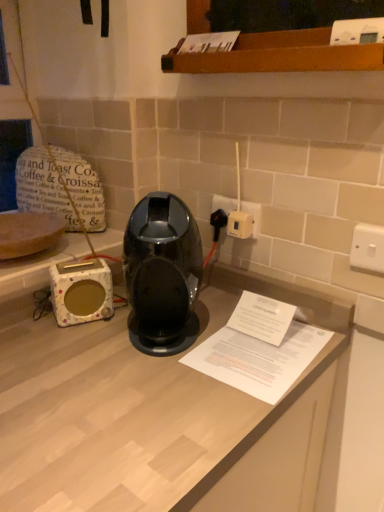
Where is `white plastic switch at upper right, the second electric outlet when ordered from back to front`? This screenshot has width=384, height=512. white plastic switch at upper right, the second electric outlet when ordered from back to front is located at coordinates (368, 248).

What do you see at coordinates (368, 248) in the screenshot? I see `white plastic switch at upper right, placed as the first electric outlet when sorted from right to left` at bounding box center [368, 248].

The image size is (384, 512). Describe the element at coordinates (258, 359) in the screenshot. I see `white paper at center` at that location.

Describe the element at coordinates (278, 55) in the screenshot. I see `wooden shelf at upper center` at that location.

Identify the location of white plastic plug at center-right, the first electric outlet from the back. This screenshot has width=384, height=512. (253, 215).

From the image's perspective, which one is positioned lower, white paper at center or white plastic socket at center-right?

white paper at center.

Identify the location of paper located below the white plastic socket at center-right (from the image's perspective). The width and height of the screenshot is (384, 512). (258, 359).

Is white paper at center not inside white plastic socket at center-right?

Yes, white paper at center is not within white plastic socket at center-right.

Is point (233, 385) farther from camera compared to point (235, 234)?

No, it is not.

Locate an element on the screen. The image size is (384, 512). cabinetry lying above the white paper at center (from the image's perspective) is located at coordinates pos(278,55).

How different are the orientations of white paper at center and wooden shelf at upper center in degrees?

The angular difference between white paper at center and wooden shelf at upper center is 94.7 degrees.

Which is correct: white paper at center is inside wooden shelf at upper center, or outside of it?

white paper at center is located beyond the bounds of wooden shelf at upper center.

Considering the sizes of white paper at center and wooden shelf at upper center in the image, is white paper at center wider or thinner than wooden shelf at upper center?

In the image, white paper at center appears to be wider than wooden shelf at upper center.

Which is in front, point (366, 250) or point (272, 45)?

The point (272, 45) is more forward.

Which object is thinner, white plastic switch at upper right, which is the first electric outlet from front to back, or wooden shelf at upper center?

white plastic switch at upper right, which is the first electric outlet from front to back.

From the image's perspective, is white plastic switch at upper right, the second electric outlet when ordered from back to front, located beneath wooden shelf at upper center?

Yes.

Does white plastic switch at upper right, which is the first electric outlet from front to back, have a smaller size compared to wooden shelf at upper center?

Correct, white plastic switch at upper right, which is the first electric outlet from front to back, occupies less space than wooden shelf at upper center.

Is white plastic plug at center-right, the first electric outlet from the back, directly adjacent to white plastic socket at center-right?

Indeed, white plastic plug at center-right, the first electric outlet from the back, and white plastic socket at center-right are beside each other and touching.

Looking at the image, does white plastic plug at center-right, the first electric outlet from the back, seem bigger or smaller compared to white plastic socket at center-right?

In the image, white plastic plug at center-right, the first electric outlet from the back, appears to be larger than white plastic socket at center-right.

From a real-world perspective, between white plastic plug at center-right, acting as the second electric outlet starting from the right, and white plastic socket at center-right, who is vertically lower?

white plastic socket at center-right is physically lower.

Could you tell me if white plastic plug at center-right, acting as the second electric outlet starting from the right, is facing white plastic socket at center-right?

Yes, white plastic plug at center-right, acting as the second electric outlet starting from the right, is oriented towards white plastic socket at center-right.

From a real-world perspective, is white plastic plug at center-right, placed as the 2th electric outlet when sorted from front to back, on wooden shelf at upper center?

No, from a real-world perspective, white plastic plug at center-right, placed as the 2th electric outlet when sorted from front to back, is not on top of wooden shelf at upper center.

From the image's perspective, relative to wooden shelf at upper center, is white plastic plug at center-right, placed as the 2th electric outlet when sorted from front to back, above or below?

white plastic plug at center-right, placed as the 2th electric outlet when sorted from front to back, is situated lower than wooden shelf at upper center in the image.

Is white plastic plug at center-right, acting as the 1th electric outlet starting from the left, at the right side of wooden shelf at upper center?

Incorrect, white plastic plug at center-right, acting as the 1th electric outlet starting from the left, is not on the right side of wooden shelf at upper center.

Is white plastic plug at center-right, acting as the second electric outlet starting from the right, completely or partially outside of wooden shelf at upper center?

Yes, white plastic plug at center-right, acting as the second electric outlet starting from the right, is not within wooden shelf at upper center.

This screenshot has width=384, height=512. I want to click on home appliance that is above the white ceramic toaster at left (from a real-world perspective), so click(x=162, y=274).

Is white ceramic toaster at left located outside glossy plastic coffee machine at center?

white ceramic toaster at left is positioned outside glossy plastic coffee machine at center.

Is white ceramic toaster at left placed right next to glossy plastic coffee machine at center?

No, white ceramic toaster at left is not next to glossy plastic coffee machine at center.

Is white ceramic toaster at left to the left or to the right of glossy plastic coffee machine at center in the image?

From the image, it's evident that white ceramic toaster at left is to the left of glossy plastic coffee machine at center.

Does white plastic switch at upper right, the second electric outlet when ordered from back to front, have a lesser width compared to glossy plastic coffee machine at center?

Correct, the width of white plastic switch at upper right, the second electric outlet when ordered from back to front, is less than that of glossy plastic coffee machine at center.

Which object is positioned more to the right, white plastic switch at upper right, placed as the first electric outlet when sorted from right to left, or glossy plastic coffee machine at center?

white plastic switch at upper right, placed as the first electric outlet when sorted from right to left, is more to the right.

The width and height of the screenshot is (384, 512). Find the location of `home appliance that appears below the white plastic switch at upper right, the 2th electric outlet when ordered from left to right (from a real-world perspective)`. home appliance that appears below the white plastic switch at upper right, the 2th electric outlet when ordered from left to right (from a real-world perspective) is located at coordinates (162, 274).

From a real-world perspective, is white plastic switch at upper right, the 2th electric outlet when ordered from left to right, positioned over glossy plastic coffee machine at center based on gravity?

Yes, from a real-world perspective, white plastic switch at upper right, the 2th electric outlet when ordered from left to right, is on top of glossy plastic coffee machine at center.

The image size is (384, 512). In the image, there is a white plastic socket at center-right. Find the location of `paper below it (from a real-world perspective)`. paper below it (from a real-world perspective) is located at coordinates (258, 359).

You are a GUI agent. You are given a task and a screenshot of the screen. Output one action in this format:
    pyautogui.click(x=<x>, y=<y>)
    Task: Click on the cabinetry positioned vertically above the white paper at center (from a real-world perspective)
    
    Given the screenshot: What is the action you would take?
    pyautogui.click(x=278, y=55)

From the image, which object appears to be nearer to white ceramic toaster at left, white plastic plug at center-right, placed as the 2th electric outlet when sorted from front to back, or white paper at center?

The object closer to white ceramic toaster at left is white paper at center.

Looking at the image, which one is located further to white plastic plug at center-right, acting as the second electric outlet starting from the right, white plastic switch at upper right, which is the first electric outlet from front to back, or white paper at center?

white paper at center is further to white plastic plug at center-right, acting as the second electric outlet starting from the right.

In the scene shown: Estimate the real-world distances between objects in this image. Which object is closer to wooden shelf at upper center, white paper at center or white plastic switch at upper right, placed as the first electric outlet when sorted from right to left?

Based on the image, white plastic switch at upper right, placed as the first electric outlet when sorted from right to left, appears to be nearer to wooden shelf at upper center.

From the image, which object appears to be farther from white ceramic toaster at left, white paper at center or white plastic plug at center-right, the first electric outlet from the back?

white plastic plug at center-right, the first electric outlet from the back.

Which object lies further to the anchor point glossy plastic coffee machine at center, wooden shelf at upper center or white plastic switch at upper right, the second electric outlet when ordered from back to front?

Among the two, wooden shelf at upper center is located further to glossy plastic coffee machine at center.

Based on the photo, estimate the real-world distances between objects in this image. Which object is further from white plastic switch at upper right, the 2th electric outlet when ordered from left to right, white paper at center or glossy plastic coffee machine at center?

Result: Among the two, glossy plastic coffee machine at center is located further to white plastic switch at upper right, the 2th electric outlet when ordered from left to right.

Looking at the image, which one is located further to white plastic switch at upper right, the second electric outlet when ordered from back to front, white plastic socket at center-right or white paper at center?

white plastic socket at center-right lies further to white plastic switch at upper right, the second electric outlet when ordered from back to front, than the other object.

From the image, which object appears to be farther from white paper at center, wooden shelf at upper center or white plastic switch at upper right, the second electric outlet when ordered from back to front?

wooden shelf at upper center.

Locate an element on the screen. This screenshot has height=512, width=384. socket between wooden shelf at upper center and white plastic plug at center-right, acting as the second electric outlet starting from the right, along the z-axis is located at coordinates (240, 224).

In order to click on paper between white ceramic toaster at left and white plastic switch at upper right, the second electric outlet when ordered from back to front in this screenshot , I will do `click(258, 359)`.

This screenshot has height=512, width=384. I want to click on home appliance that lies between wooden shelf at upper center and white paper at center from top to bottom, so click(x=162, y=274).

Locate an element on the screen. home appliance positioned between white paper at center and white plastic plug at center-right, acting as the second electric outlet starting from the right, from near to far is located at coordinates (162, 274).